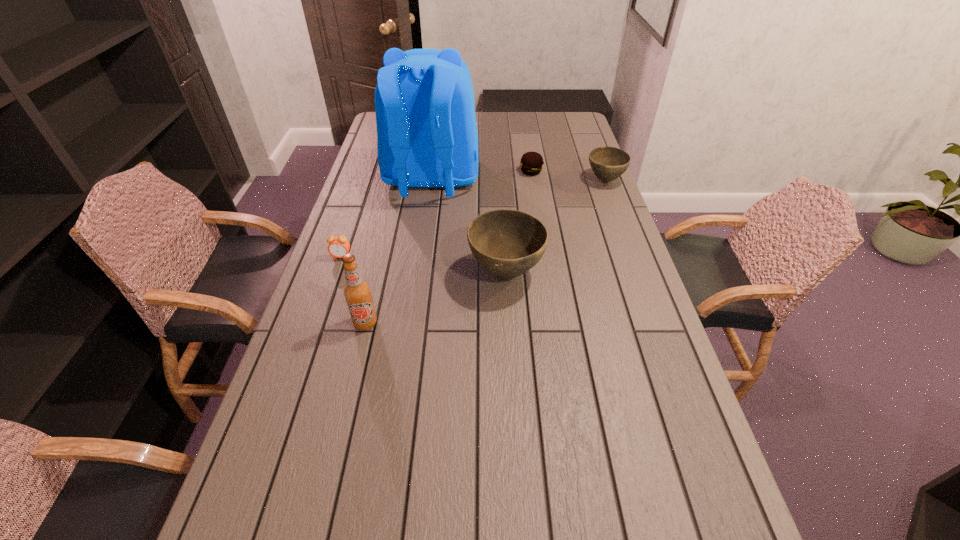
This screenshot has height=540, width=960. I want to click on the fourth closest object to the backpack, so click(608, 163).

Identify which object is the nearest to the nearer bowl. Please provide its 2D coordinates. Your answer should be formatted as a tuple, i.e. [(x, y)], where the tuple contains the x and y coordinates of a point satisfying the conditions above.

[(427, 137)]

Where is `vacant area in the image that satisfies the following two spatial constraints: 1. on the back of the farther bowl; 2. on the right side of the tallest object`? vacant area in the image that satisfies the following two spatial constraints: 1. on the back of the farther bowl; 2. on the right side of the tallest object is located at coordinates (432, 180).

Where is `free region that satisfies the following two spatial constraints: 1. on the back side of the nearer bowl; 2. on the left side of the patty`? The width and height of the screenshot is (960, 540). free region that satisfies the following two spatial constraints: 1. on the back side of the nearer bowl; 2. on the left side of the patty is located at coordinates (499, 172).

This screenshot has height=540, width=960. Find the location of `vacant region that satisfies the following two spatial constraints: 1. on the back side of the nearer bowl; 2. on the right side of the patty`. vacant region that satisfies the following two spatial constraints: 1. on the back side of the nearer bowl; 2. on the right side of the patty is located at coordinates (499, 172).

You are a GUI agent. You are given a task and a screenshot of the screen. Output one action in this format:
    pyautogui.click(x=<x>, y=<y>)
    Task: Click on the vacant area in the image that satisfies the following two spatial constraints: 1. on the back side of the shorter bowl; 2. on the left side of the left bowl
    This screenshot has width=960, height=540.
    Given the screenshot: What is the action you would take?
    pyautogui.click(x=500, y=180)

Find the location of a particular element. This screenshot has width=960, height=540. vacant point that satisfies the following two spatial constraints: 1. on the back of the rightmost object; 2. on the left side of the backpack is located at coordinates (432, 180).

Where is `vacant area that satisfies the following two spatial constraints: 1. on the back of the shorter bowl; 2. on the left side of the tallest object`? The width and height of the screenshot is (960, 540). vacant area that satisfies the following two spatial constraints: 1. on the back of the shorter bowl; 2. on the left side of the tallest object is located at coordinates (432, 180).